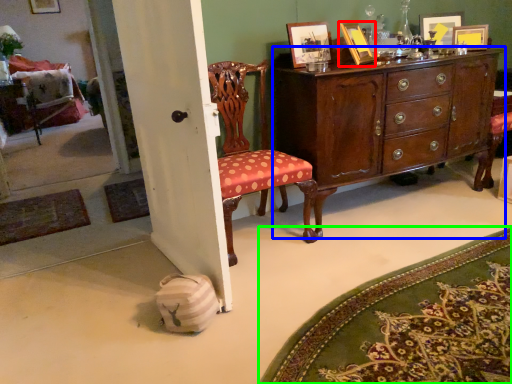
Question: Which object is the farthest from picture frame (highlighted by a red box)? Choose among these: cabinetry (highlighted by a blue box) or mat (highlighted by a green box).

Choices:
 (A) cabinetry
 (B) mat

Answer: (B)